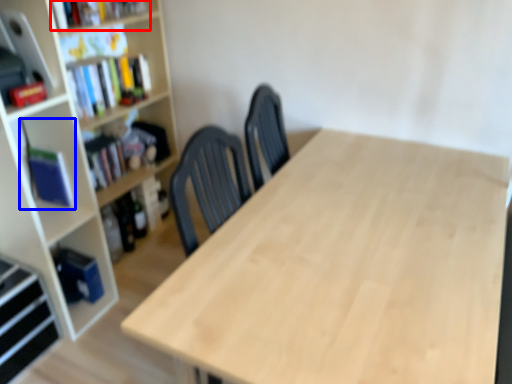
Question: Which object is closer to the camera taking this photo, book (highlighted by a red box) or book (highlighted by a blue box)?

Choices:
 (A) book
 (B) book

Answer: (A)